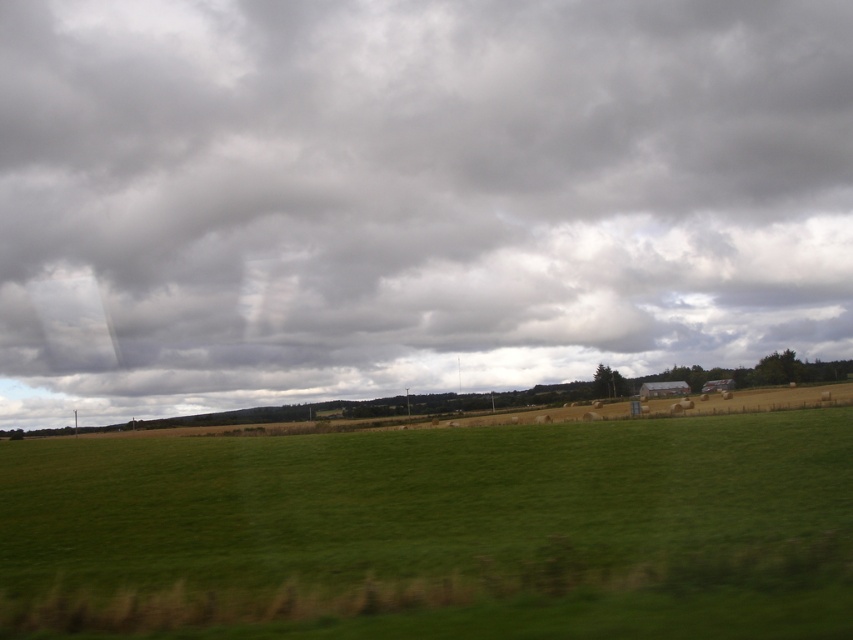
You are a drone operator planning to fly a drone from the point at coordinates point (12, 227) to the point at coordinates point (140, 522). Considering the rural landscape described, will the drone have an unobstructed path between these two points?

The point at coordinates point (12, 227) is behind point (140, 522), so the drone will have an unobstructed path between these two points as there are no objects blocking the flight path between them according to the scene description.

Based on the scene described, which object occupies a larger portion of the image between the gray cloudy sky at upper center and the green grassy field at center?

The gray cloudy sky at upper center is bigger than the green grassy field at center according to the description.

You are standing in the middle of the green grassy field at center and looking towards the gray cloudy sky at upper center. Which object is closer to your eyes?

The gray cloudy sky at upper center is closer to your eyes because it is positioned further to the viewer than the green grassy field at center.